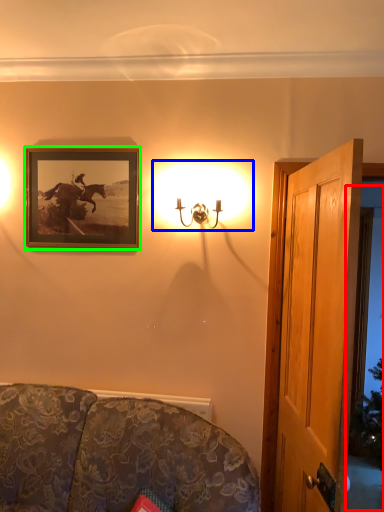
Question: Based on their relative distances, which object is nearer to window (highlighted by a red box)? Choose from lamp (highlighted by a blue box) and picture frame (highlighted by a green box).

Choices:
 (A) lamp
 (B) picture frame

Answer: (A)